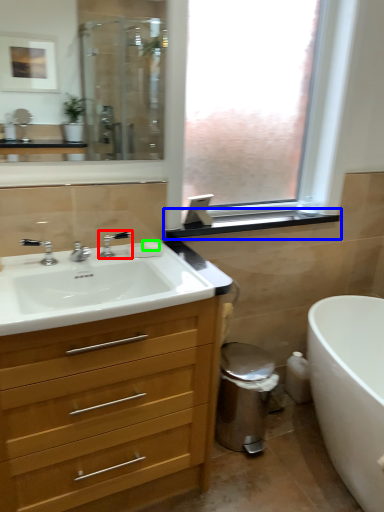
Question: Estimate the real-world distances between objects in this image. Which object is closer to tap (highlighted by a red box), window sill (highlighted by a blue box) or soap (highlighted by a green box)?

Choices:
 (A) window sill
 (B) soap

Answer: (B)